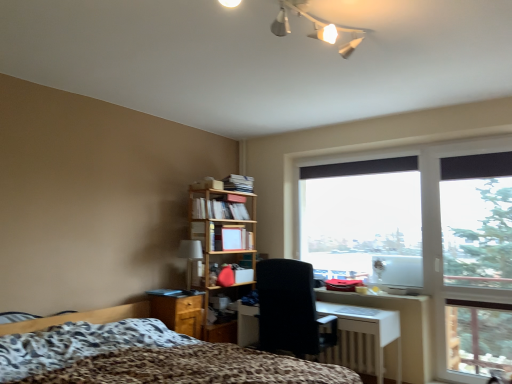
Question: Considering the relative sizes of matte wooden bookshelf at center and leopard print fabric bed at lower left in the image provided, is matte wooden bookshelf at center wider than leopard print fabric bed at lower left?

Choices:
 (A) yes
 (B) no

Answer: (B)

Question: Is matte wooden bookshelf at center shorter than leopard print fabric bed at lower left?

Choices:
 (A) yes
 (B) no

Answer: (A)

Question: From the image's perspective, is matte wooden bookshelf at center below leopard print fabric bed at lower left?

Choices:
 (A) no
 (B) yes

Answer: (A)

Question: Is matte wooden bookshelf at center outside leopard print fabric bed at lower left?

Choices:
 (A) no
 (B) yes

Answer: (B)

Question: Can you confirm if matte wooden bookshelf at center is bigger than leopard print fabric bed at lower left?

Choices:
 (A) yes
 (B) no

Answer: (B)

Question: From a real-world perspective, is wooden/file cabinet at lower left above or below matte wooden bookshelf at center?

Choices:
 (A) above
 (B) below

Answer: (B)

Question: Considering their positions, is wooden/file cabinet at lower left located in front of or behind matte wooden bookshelf at center?

Choices:
 (A) front
 (B) behind

Answer: (A)

Question: Based on their sizes in the image, would you say wooden/file cabinet at lower left is bigger or smaller than matte wooden bookshelf at center?

Choices:
 (A) big
 (B) small

Answer: (A)

Question: Based on their positions, is wooden/file cabinet at lower left located to the left or right of matte wooden bookshelf at center?

Choices:
 (A) right
 (B) left

Answer: (B)

Question: Is white glossy desk at center wider or thinner than matte beige table lamp at center-left?

Choices:
 (A) wide
 (B) thin

Answer: (A)

Question: Relative to matte beige table lamp at center-left, is white glossy desk at center in front or behind?

Choices:
 (A) front
 (B) behind

Answer: (A)

Question: Would you say white glossy desk at center is inside or outside matte beige table lamp at center-left?

Choices:
 (A) inside
 (B) outside

Answer: (B)

Question: From a real-world perspective, is white glossy desk at center above or below matte beige table lamp at center-left?

Choices:
 (A) below
 (B) above

Answer: (A)

Question: Is transparent glass window at center in front of or behind white glossy desk at center in the image?

Choices:
 (A) front
 (B) behind

Answer: (B)

Question: From a real-world perspective, is transparent glass window at center physically located above or below white glossy desk at center?

Choices:
 (A) above
 (B) below

Answer: (A)